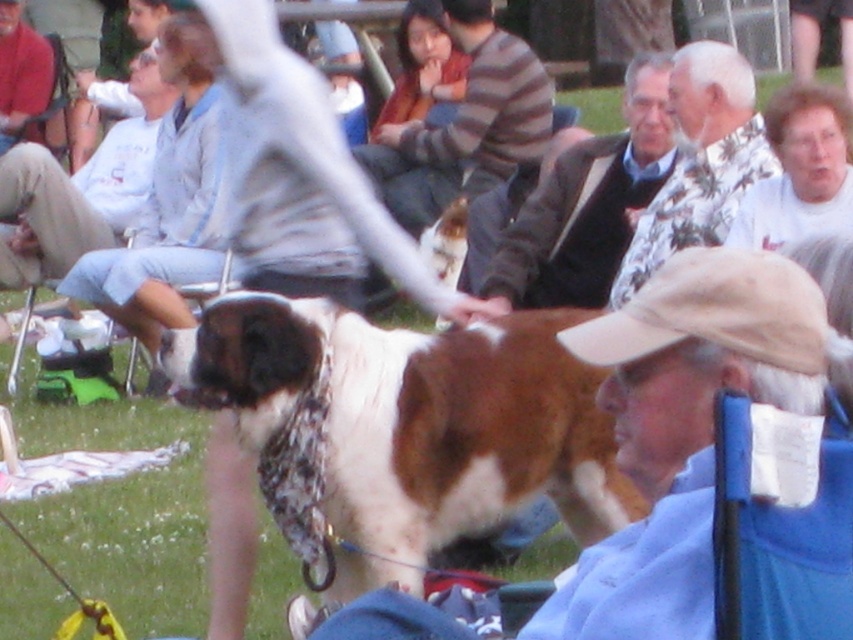
What do you see at coordinates (700, 161) in the screenshot? I see `floral shirt at upper right` at bounding box center [700, 161].

Can you confirm if floral shirt at upper right is positioned to the left of white cotton shirt at upper right?

Yes, floral shirt at upper right is to the left of white cotton shirt at upper right.

Find the location of a particular element. The width and height of the screenshot is (853, 640). floral shirt at upper right is located at coordinates (700, 161).

Is brown and white fur at center bigger than floral shirt at upper right?

Indeed, brown and white fur at center has a larger size compared to floral shirt at upper right.

In the scene shown: Which is more to the left, brown and white fur at center or floral shirt at upper right?

Positioned to the left is brown and white fur at center.

What do you see at coordinates (421, 422) in the screenshot? I see `brown and white fur at center` at bounding box center [421, 422].

Locate an element on the screen. brown and white fur at center is located at coordinates (421, 422).

Consider the image. Does floral-patterned sweater at center appear on the left side of white cotton shirt at upper right?

Correct, you'll find floral-patterned sweater at center to the left of white cotton shirt at upper right.

Identify the location of floral-patterned sweater at center. (587, 204).